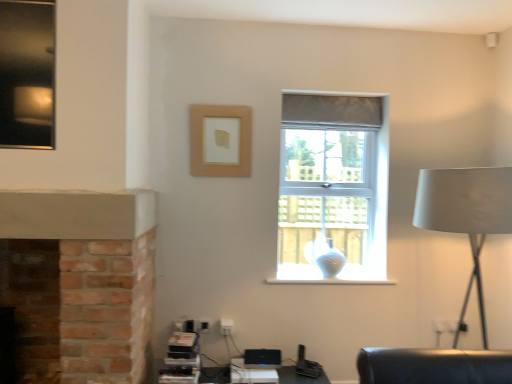
Where is `free space between translucent glass vase at window and clear glass window at center`? This screenshot has width=512, height=384. free space between translucent glass vase at window and clear glass window at center is located at coordinates (330, 282).